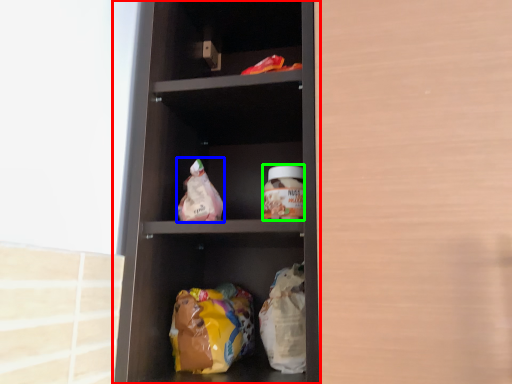
Question: Considering the real-world distances, which object is farthest from shelf (highlighted by a red box)? snack (highlighted by a blue box) or glass jar (highlighted by a green box)?

Choices:
 (A) snack
 (B) glass jar

Answer: (B)